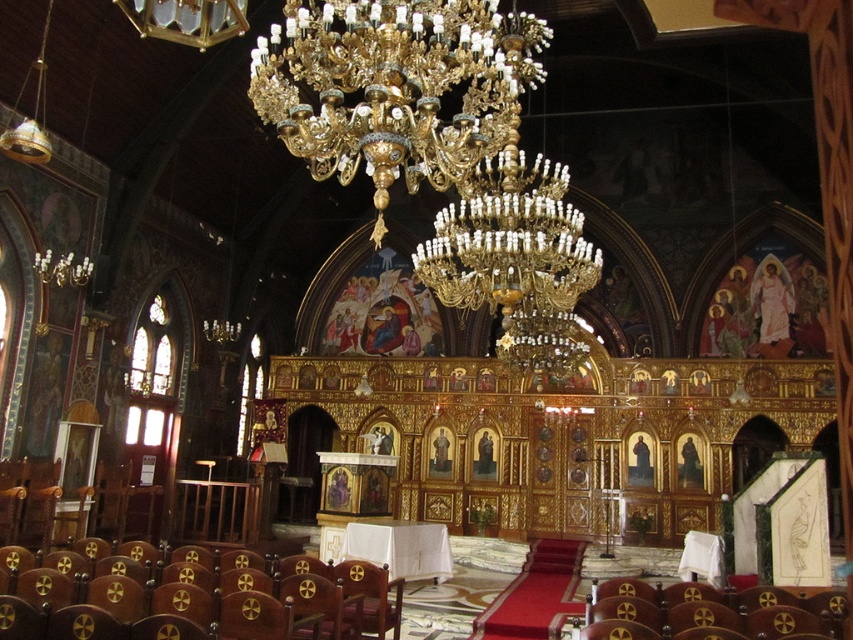
You are standing in the church and want to take a photo of the point at coordinates point (582,355). If your camera has a maximum focus range of 50 meters, will you be able to focus on the point?

The point (582,355) is 57.97 meters away from the camera, which exceeds the maximum focus range of 50 meters. Therefore, the camera cannot focus on the point.

You are standing in the church and want to walk towards both the point at coordinates point (x=323, y=156) and point (x=561, y=237). Which point should you approach first to reach the one closer to you?

You should approach point (x=323, y=156) first because it is closer to you than point (x=561, y=237).